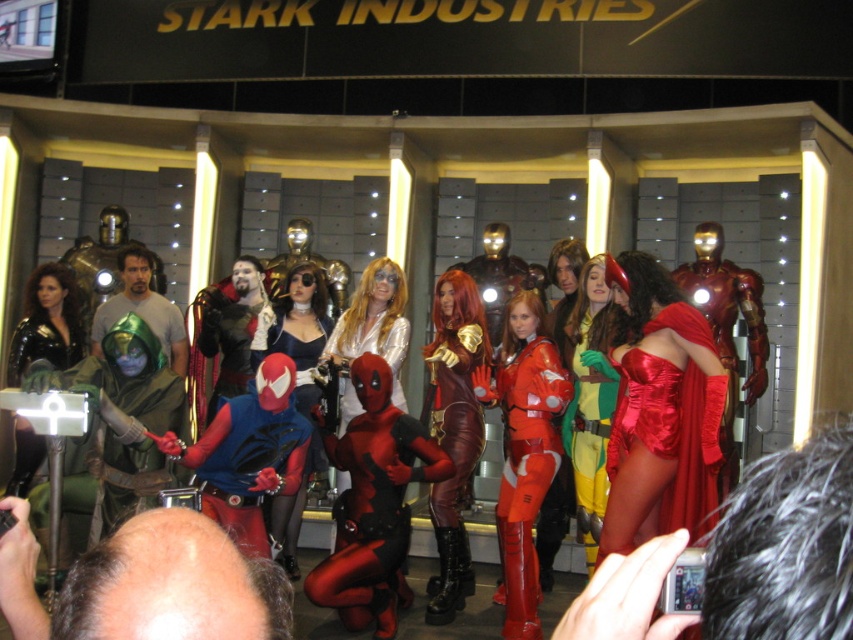
How far apart are leather-like red suit at center and shiny red bodysuit at center?

leather-like red suit at center and shiny red bodysuit at center are 4.89 feet apart.

Is leather-like red suit at center below shiny red bodysuit at center?

Yes.

Is point (444, 616) closer to viewer compared to point (604, 289)?

Yes, point (444, 616) is in front of point (604, 289).

Identify the location of leather-like red suit at center. (454, 432).

Between shiny red bodysuit at center and shiny blue dress at center, which one has more height?

shiny red bodysuit at center is taller.

Does shiny red bodysuit at center appear on the left side of shiny blue dress at center?

No, shiny red bodysuit at center is not to the left of shiny blue dress at center.

Is point (592, 305) positioned in front of point (264, 333)?

Yes, point (592, 305) is closer to viewer.

Identify the location of shiny red bodysuit at center. This screenshot has width=853, height=640. (590, 400).

Between shiny red suit at center and shiny silver dress at center, which one has less height?

shiny silver dress at center is shorter.

Does shiny red suit at center appear on the left side of shiny silver dress at center?

In fact, shiny red suit at center is to the right of shiny silver dress at center.

Locate an element on the screen. Image resolution: width=853 pixels, height=640 pixels. shiny red suit at center is located at coordinates (524, 451).

At what (x,y) coordinates should I click in order to perform the action: click on shiny red suit at center. Please return your answer as a coordinate pair (x, y). This screenshot has width=853, height=640. Looking at the image, I should click on (524, 451).